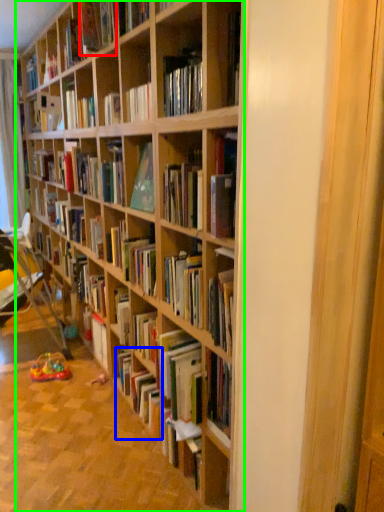
Question: Considering the real-world distances, which object is closest to book (highlighted by a red box)? book (highlighted by a blue box) or bookcase (highlighted by a green box).

Choices:
 (A) book
 (B) bookcase

Answer: (B)